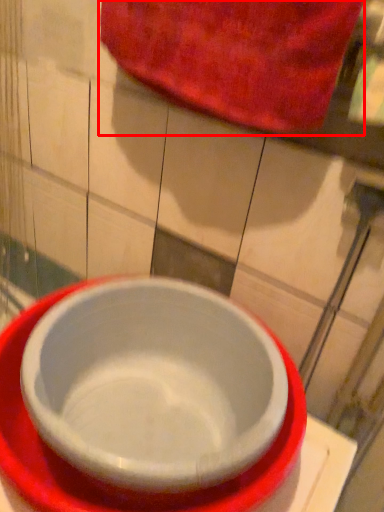
Question: In this image, where is beach towel (annotated by the red box) located relative to bowl?

Choices:
 (A) left
 (B) right

Answer: (B)